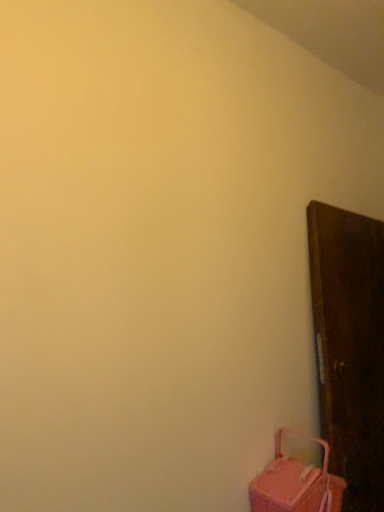
Question: Should I look upward or downward to see pink fabric suitcase at lower right?

Choices:
 (A) up
 (B) down

Answer: (B)